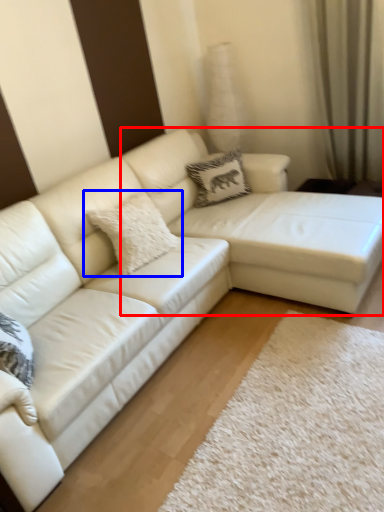
Question: Which object appears closest to the camera in this image, couch (highlighted by a red box) or pillow (highlighted by a blue box)?

Choices:
 (A) couch
 (B) pillow

Answer: (A)